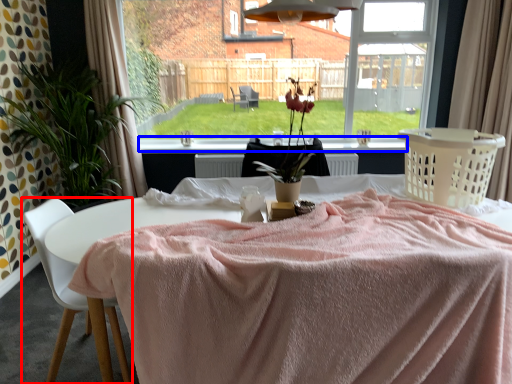
Question: Which object appears closest to the camera in this image, chair (highlighted by a red box) or window sill (highlighted by a blue box)?

Choices:
 (A) chair
 (B) window sill

Answer: (A)